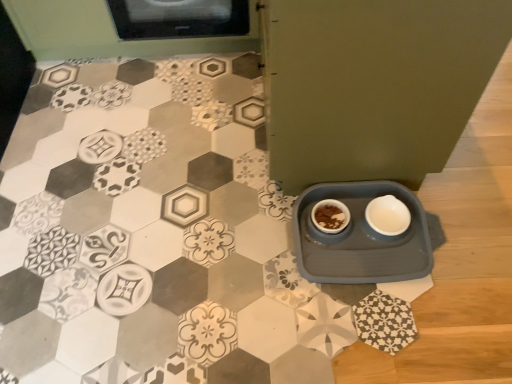
I want to click on vacant space to the left of gray plastic tray at lower right, so click(x=243, y=251).